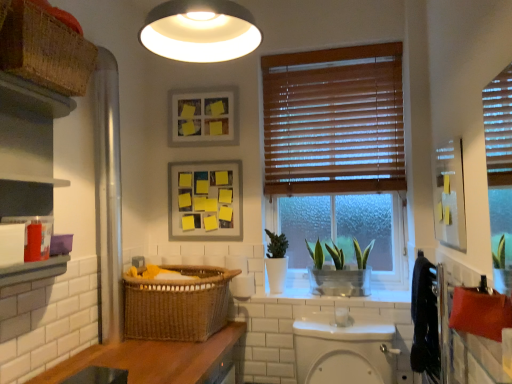
Image resolution: width=512 pixels, height=384 pixels. Identify the location of metallic silver medicine cabinet at upper right. (449, 195).

Identify the location of matte wooden picture frame at upper center, acting as the first picture frame starting from the top. (203, 117).

Measure the distance between wooden countertop at lower left and camera.

The distance of wooden countertop at lower left from camera is 5.17 feet.

Where is `woven brown basket at upper left, which is the second basket in bottom-to-top order`? This screenshot has width=512, height=384. woven brown basket at upper left, which is the second basket in bottom-to-top order is located at coordinates (45, 50).

This screenshot has width=512, height=384. In order to click on white glossy toilet bowl at center in this screenshot , I will do `click(344, 351)`.

Locate an element on the screen. metallic silver medicine cabinet at upper right is located at coordinates (449, 195).

Image resolution: width=512 pixels, height=384 pixels. In order to click on houseplant on the right of woven brown basket at upper left, the 2th basket in the back-to-front sequence in this screenshot , I will do 342,274.

From the image's perspective, is green leafy plant in metallic pot at center located above or below woven brown basket at upper left, marked as the first basket in a left-to-right arrangement?

green leafy plant in metallic pot at center is situated lower than woven brown basket at upper left, marked as the first basket in a left-to-right arrangement, in the image.

Which of these two, green leafy plant in metallic pot at center or woven brown basket at upper left, the first basket in the front-to-back sequence, is bigger?

With larger size is woven brown basket at upper left, the first basket in the front-to-back sequence.

Is yellow sticky notes on matte paper at upper center, arranged as the 2th picture frame when viewed from the top, not within wooden countertop at lower left?

Indeed, yellow sticky notes on matte paper at upper center, arranged as the 2th picture frame when viewed from the top, is completely outside wooden countertop at lower left.

Does yellow sticky notes on matte paper at upper center, which ranks as the 1th picture frame in bottom-to-top order, lie in front of wooden countertop at lower left?

No, yellow sticky notes on matte paper at upper center, which ranks as the 1th picture frame in bottom-to-top order, is further to the viewer.

Considering the relative sizes of yellow sticky notes on matte paper at upper center, which ranks as the 1th picture frame in bottom-to-top order, and wooden countertop at lower left in the image provided, is yellow sticky notes on matte paper at upper center, which ranks as the 1th picture frame in bottom-to-top order, thinner than wooden countertop at lower left?

Indeed, yellow sticky notes on matte paper at upper center, which ranks as the 1th picture frame in bottom-to-top order, has a lesser width compared to wooden countertop at lower left.

From the picture: Is green leafy plant in metallic pot at center aimed at matte black cabinet at left?

No, green leafy plant in metallic pot at center is not turned towards matte black cabinet at left.

Is green leafy plant in metallic pot at center far away from matte black cabinet at left?

green leafy plant in metallic pot at center is positioned a significant distance from matte black cabinet at left.

Which of these two, green leafy plant in metallic pot at center or matte black cabinet at left, stands taller?

matte black cabinet at left.

From the image's perspective, is green leafy plant in metallic pot at center positioned above or below matte black cabinet at left?

Clearly, from the image's perspective, green leafy plant in metallic pot at center is below matte black cabinet at left.

Which is correct: green leafy plant in metallic pot at center is inside white matte light fixture at upper center, or outside of it?

green leafy plant in metallic pot at center exists outside the volume of white matte light fixture at upper center.

From a real-world perspective, is green leafy plant in metallic pot at center above or below white matte light fixture at upper center?

green leafy plant in metallic pot at center is situated lower than white matte light fixture at upper center in the real world.

Is green leafy plant in metallic pot at center beside white matte light fixture at upper center?

green leafy plant in metallic pot at center and white matte light fixture at upper center are clearly separated.

Is green leafy plant in metallic pot at center positioned behind white matte light fixture at upper center?

Yes, the depth of green leafy plant in metallic pot at center is greater than that of white matte light fixture at upper center.

Who is smaller, yellow sticky notes on matte paper at upper center, which ranks as the 1th picture frame in bottom-to-top order, or black fabric towel at right?

With smaller size is yellow sticky notes on matte paper at upper center, which ranks as the 1th picture frame in bottom-to-top order.

Are yellow sticky notes on matte paper at upper center, arranged as the 2th picture frame when viewed from the top, and black fabric towel at right far apart?

Absolutely, yellow sticky notes on matte paper at upper center, arranged as the 2th picture frame when viewed from the top, is distant from black fabric towel at right.

Can you confirm if yellow sticky notes on matte paper at upper center, which ranks as the 1th picture frame in bottom-to-top order, is wider than black fabric towel at right?

No.

Is black fabric towel at right at the back of yellow sticky notes on matte paper at upper center, which ranks as the 1th picture frame in bottom-to-top order?

No, black fabric towel at right is not at the back of yellow sticky notes on matte paper at upper center, which ranks as the 1th picture frame in bottom-to-top order.

Between green leafy plant in metallic pot at center and wooden blinds at center, which one appears on the right side from the viewer's perspective?

From the viewer's perspective, green leafy plant in metallic pot at center appears more on the right side.

From a real-world perspective, which is physically above, green leafy plant in metallic pot at center or wooden blinds at center?

From a 3D spatial view, wooden blinds at center is above.

From the image's perspective, does green leafy plant in metallic pot at center appear lower than wooden blinds at center?

Correct, green leafy plant in metallic pot at center appears lower than wooden blinds at center in the image.

Does point (350, 295) come closer to viewer compared to point (288, 153)?

Yes, point (350, 295) is closer to viewer.

Does white glossy faucet at lower center have a lesser height compared to white glossy toilet bowl at center?

Correct, white glossy faucet at lower center is not as tall as white glossy toilet bowl at center.

Based on the photo, from the image's perspective, would you say white glossy faucet at lower center is shown under white glossy toilet bowl at center?

No.

Looking at this image, measure the distance from white glossy faucet at lower center to white glossy toilet bowl at center.

white glossy faucet at lower center and white glossy toilet bowl at center are 19.49 centimeters apart from each other.

Is white glossy toilet bowl at center surrounded by white glossy faucet at lower center?

Actually, white glossy toilet bowl at center is outside white glossy faucet at lower center.

Image resolution: width=512 pixels, height=384 pixels. Identify the location of houseplant behind the woven brown basket at upper left, the 2th basket from the right. (342, 274).

Locate an element on the screen. The height and width of the screenshot is (384, 512). counter top lying on the left of yellow sticky notes on matte paper at upper center, which ranks as the 1th picture frame in bottom-to-top order is located at coordinates (155, 359).

Based on their spatial positions, is woven brown basket at lower left, which appears as the 1th basket when viewed from the right, or wooden blinds at center further from yellow sticky notes on matte paper at upper center, arranged as the 2th picture frame when viewed from the top?

Based on the image, woven brown basket at lower left, which appears as the 1th basket when viewed from the right, appears to be further to yellow sticky notes on matte paper at upper center, arranged as the 2th picture frame when viewed from the top.

When comparing their distances from white matte light fixture at upper center, does green leafy plant in metallic pot at center or white glossy toilet bowl at center seem closer?

green leafy plant in metallic pot at center is closer to white matte light fixture at upper center.

Based on their spatial positions, is black fabric towel at right or white matte light fixture at upper center closer to matte wooden picture frame at upper center, which ranks as the second picture frame in bottom-to-top order?

white matte light fixture at upper center lies closer to matte wooden picture frame at upper center, which ranks as the second picture frame in bottom-to-top order, than the other object.

Looking at the image, which one is located further to woven brown basket at lower left, marked as the second basket in a top-to-bottom arrangement, yellow sticky notes on matte paper at upper center, which ranks as the 1th picture frame in bottom-to-top order, or black fabric towel at right?

black fabric towel at right is further to woven brown basket at lower left, marked as the second basket in a top-to-bottom arrangement.

Estimate the real-world distances between objects in this image. Which object is closer to white glossy toilet bowl at center, green leafy plant in metallic pot at center or wooden blinds at center?

green leafy plant in metallic pot at center is positioned closer to the anchor white glossy toilet bowl at center.

Considering their positions, is metallic silver medicine cabinet at upper right positioned further to woven brown basket at upper left, which is the second basket in bottom-to-top order, than white matte light fixture at upper center?

The object further to woven brown basket at upper left, which is the second basket in bottom-to-top order, is metallic silver medicine cabinet at upper right.

Based on their spatial positions, is woven brown basket at lower left, which ranks as the first basket in back-to-front order, or wooden countertop at lower left further from yellow sticky notes on matte paper at upper center, which ranks as the 1th picture frame in bottom-to-top order?

The object further to yellow sticky notes on matte paper at upper center, which ranks as the 1th picture frame in bottom-to-top order, is wooden countertop at lower left.

Estimate the real-world distances between objects in this image. Which object is closer to matte black cabinet at left, white glossy toilet bowl at center or woven brown basket at lower left, the 2th basket from the front?

woven brown basket at lower left, the 2th basket from the front, is closer to matte black cabinet at left.

You are a GUI agent. You are given a task and a screenshot of the screen. Output one action in this format:
    pyautogui.click(x=<x>, y=<y>)
    Task: Click on the toilet bowl between matte black cabinet at left and yellow sticky notes on matte paper at upper center, which ranks as the 1th picture frame in bottom-to-top order, in the front-back direction
    The height and width of the screenshot is (384, 512).
    Given the screenshot: What is the action you would take?
    pyautogui.click(x=344, y=351)

Identify the location of basket that lies between matte black cabinet at left and wooden countertop at lower left from top to bottom. The image size is (512, 384). (177, 304).

Find the location of `houseplant between wooden countertop at lower left and yellow sticky notes on matte paper at upper center, arranged as the 2th picture frame when viewed from the top, from front to back`. houseplant between wooden countertop at lower left and yellow sticky notes on matte paper at upper center, arranged as the 2th picture frame when viewed from the top, from front to back is located at coordinates (342, 274).

This screenshot has width=512, height=384. Identify the location of houseplant situated between matte wooden picture frame at upper center, which ranks as the second picture frame in bottom-to-top order, and black fabric towel at right from left to right. (342, 274).